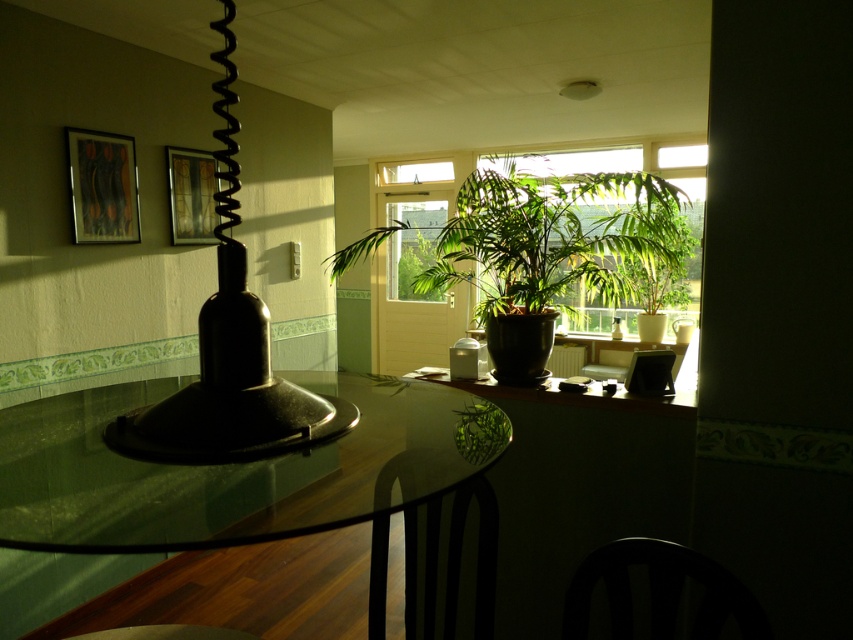
Question: Which point is closer to the camera?

Choices:
 (A) (474, 492)
 (B) (175, 234)
 (C) (653, 592)
 (D) (138, 240)

Answer: (C)

Question: Which of these objects is positioned farthest from the wooden picture frame at upper left?

Choices:
 (A) matte black lampshade at left
 (B) transparent glass table at center
 (C) metallic silver picture frame at upper left
 (D) black wood chair at lower center

Answer: (D)

Question: Is matte black lampshade at left in front of black metal chair at lower center?

Choices:
 (A) no
 (B) yes

Answer: (B)

Question: Is matte black lampshade at left thinner than wooden picture frame at upper left?

Choices:
 (A) yes
 (B) no

Answer: (B)

Question: Among these objects, which one is farthest from the camera?

Choices:
 (A) green glossy plant at center
 (B) black wood chair at lower center
 (C) black metal chair at lower center
 (D) metallic silver picture frame at upper left

Answer: (D)

Question: Can you confirm if matte black lampshade at left is positioned to the left of black metal chair at lower center?

Choices:
 (A) yes
 (B) no

Answer: (A)